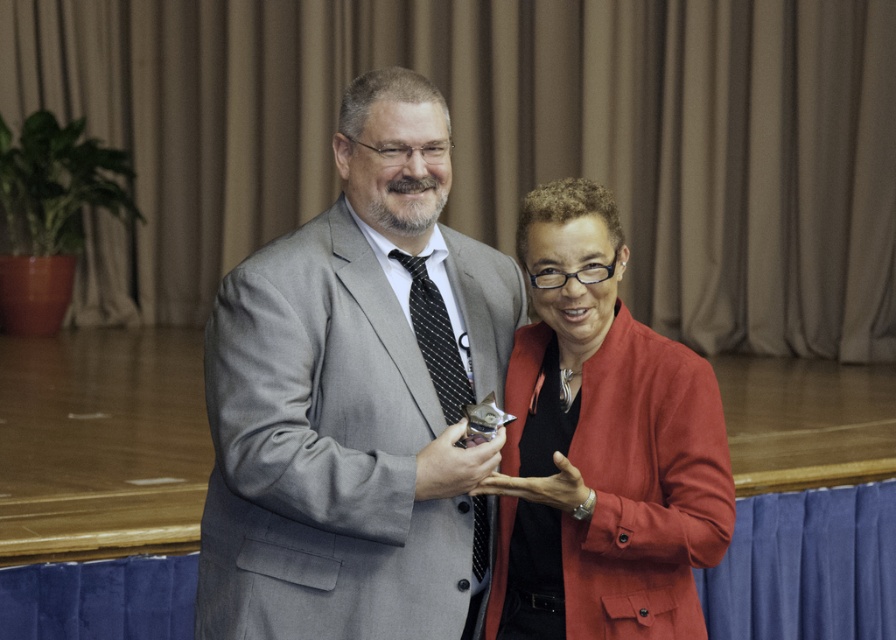
You are a photographer at the event and need to adjust the camera focus. Which person should you focus on first if you want to capture both the gray suit at center and the matte red blazer at center in sharp detail?

The gray suit at center has a larger size compared to matte red blazer at center, so you should focus on the gray suit at center first to ensure proper depth of field for both subjects.